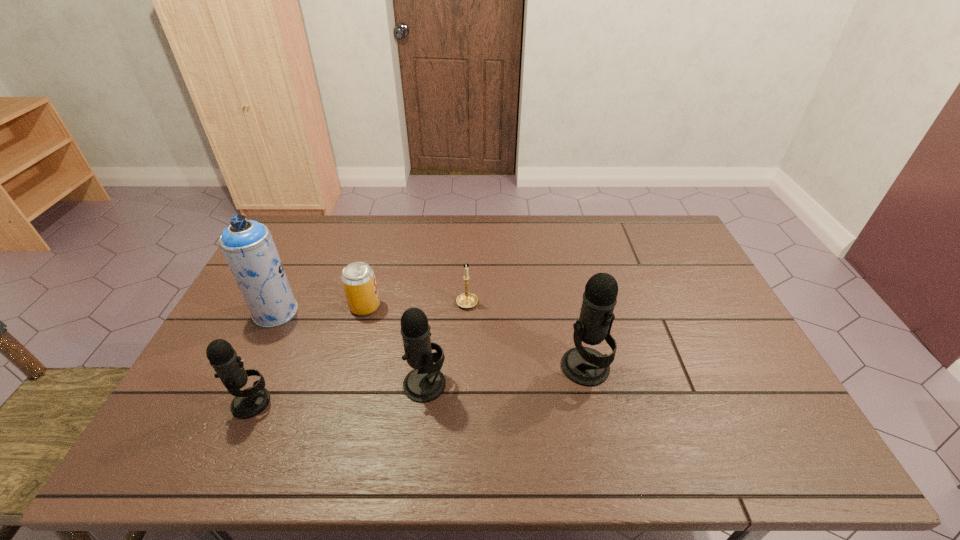
Identify the location of the third shortest object. point(249,402).

Locate an element on the screen. the shortest microphone is located at coordinates (249, 402).

In order to click on the fourth shortest object in this screenshot , I will do `click(425, 383)`.

In order to click on the second microphone from left to right in this screenshot , I will do `click(425, 383)`.

Where is `the rightmost microphone`? the rightmost microphone is located at coordinates (585, 366).

Where is `the fourth object from right to left`? The height and width of the screenshot is (540, 960). the fourth object from right to left is located at coordinates [x=358, y=278].

Find the location of `aerosol can`. aerosol can is located at coordinates (248, 246).

The height and width of the screenshot is (540, 960). I want to click on candle holder, so click(x=466, y=300).

The height and width of the screenshot is (540, 960). Find the location of `vacant space located 0.110m on the left of the fourth tallest object`. vacant space located 0.110m on the left of the fourth tallest object is located at coordinates (188, 402).

Locate an element on the screen. free space located on the right of the second shortest microphone is located at coordinates (540, 384).